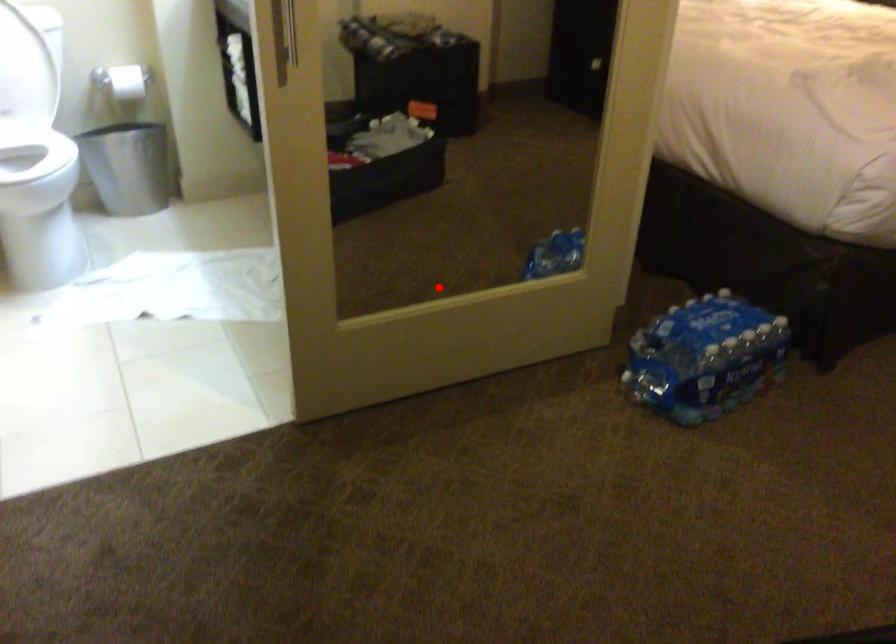
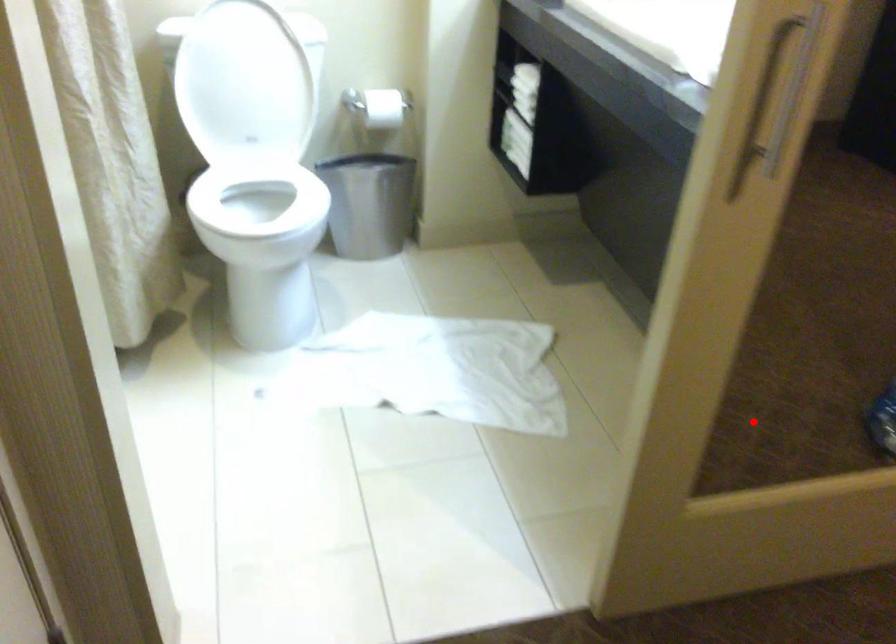
I am providing you with two images of the same scene from different viewpoints. A red point is marked on the first image and another point is marked on the second image. Does the point marked in image1 correspond to the same location as the one in image2?

Yes